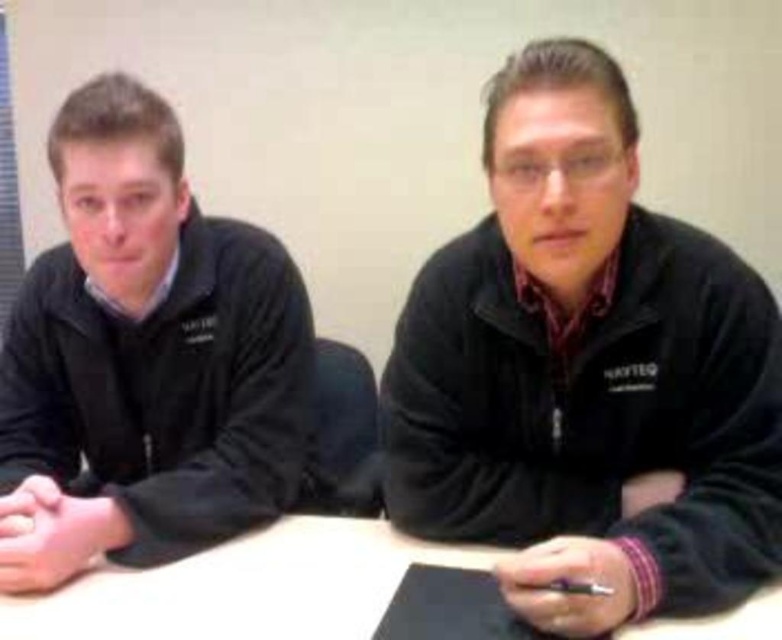
Question: Is black fleece jacket at center positioned in front of black fleece jacket at left?

Choices:
 (A) no
 (B) yes

Answer: (B)

Question: Among these objects, which one is nearest to the camera?

Choices:
 (A) white matte table at center
 (B) black fleece jacket at center

Answer: (B)

Question: Is black fleece jacket at center bigger than black fleece jacket at left?

Choices:
 (A) yes
 (B) no

Answer: (B)

Question: Can you confirm if black fleece jacket at left is positioned above white matte table at center?

Choices:
 (A) yes
 (B) no

Answer: (A)

Question: Estimate the real-world distances between objects in this image. Which object is farther from the black fleece jacket at center?

Choices:
 (A) black fleece jacket at left
 (B) white matte table at center

Answer: (A)

Question: Which of these objects is positioned closest to the black fleece jacket at center?

Choices:
 (A) black fleece jacket at left
 (B) white matte table at center

Answer: (B)